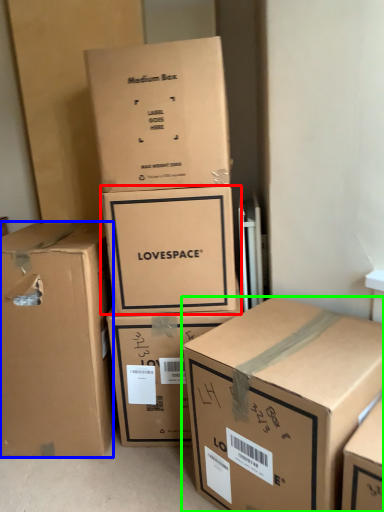
Question: Based on their relative distances, which object is farther from box (highlighted by a red box)? Choose from box (highlighted by a blue box) and box (highlighted by a green box).

Choices:
 (A) box
 (B) box

Answer: (B)